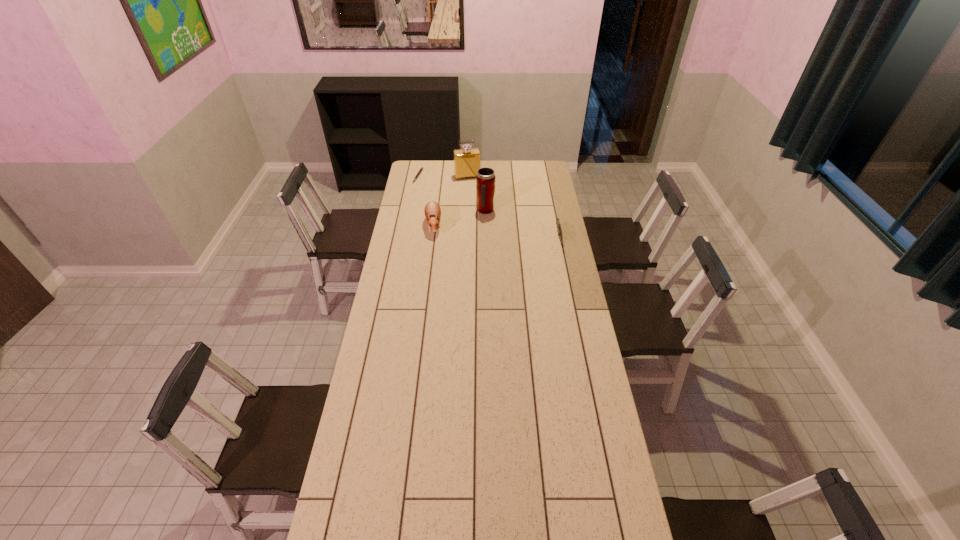
Locate an element on the screen. free spot between the third tallest object and the fourth tallest object is located at coordinates (496, 231).

What are the coordinates of `vacant space in between the perfume and the thermos bottle` in the screenshot? It's located at (476, 194).

Image resolution: width=960 pixels, height=540 pixels. I want to click on vacant area that lies between the thermos bottle and the perfume, so click(476, 194).

The image size is (960, 540). Find the location of `vacant area that lies between the second object from left to right and the thermos bottle`. vacant area that lies between the second object from left to right and the thermos bottle is located at coordinates (460, 218).

The height and width of the screenshot is (540, 960). I want to click on free point between the perfume and the rightmost object, so click(x=514, y=207).

Where is `free spot between the rightmost object and the perfume`? This screenshot has width=960, height=540. free spot between the rightmost object and the perfume is located at coordinates (514, 207).

Where is `free space that is in between the gun and the second object from left to right`? The image size is (960, 540). free space that is in between the gun and the second object from left to right is located at coordinates (496, 231).

Find the location of a particular element. free space between the leftmost object and the hamster is located at coordinates (426, 200).

Locate an element on the screen. vacant space that's between the thermos bottle and the fourth object from right to left is located at coordinates pyautogui.click(x=460, y=218).

What are the coordinates of `vacant region between the thermos bottle and the pen` in the screenshot? It's located at (452, 193).